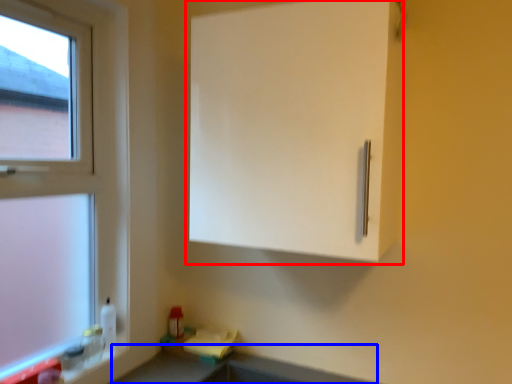
Question: Which point is closer to the camera, cabinetry (highlighted by a red box) or counter top (highlighted by a blue box)?

Choices:
 (A) cabinetry
 (B) counter top

Answer: (B)